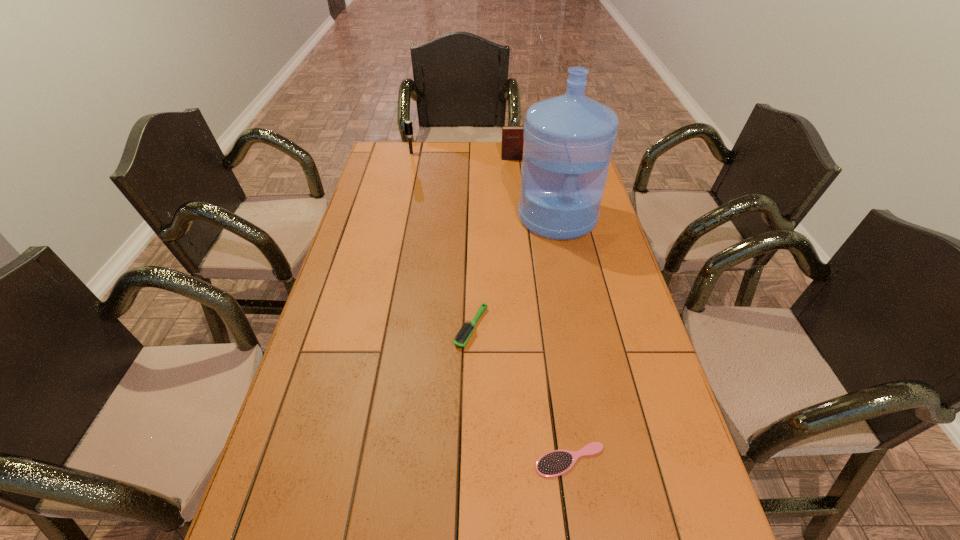
Image resolution: width=960 pixels, height=540 pixels. Find the location of `hairbrush identified as the closest to the second shortest object`. hairbrush identified as the closest to the second shortest object is located at coordinates (555, 463).

At what (x,y) coordinates should I click in order to perform the action: click on free location that satisfies the following two spatial constraints: 1. on the front side of the second tallest hairbrush; 2. on the right side of the shortest object. Please return your answer as a coordinate pair (x, y). This screenshot has width=960, height=540. Looking at the image, I should click on (469, 460).

Identify the location of free location that satisfies the following two spatial constraints: 1. on the front side of the rightmost hairbrush; 2. on the left side of the tallest hairbrush. (342, 460).